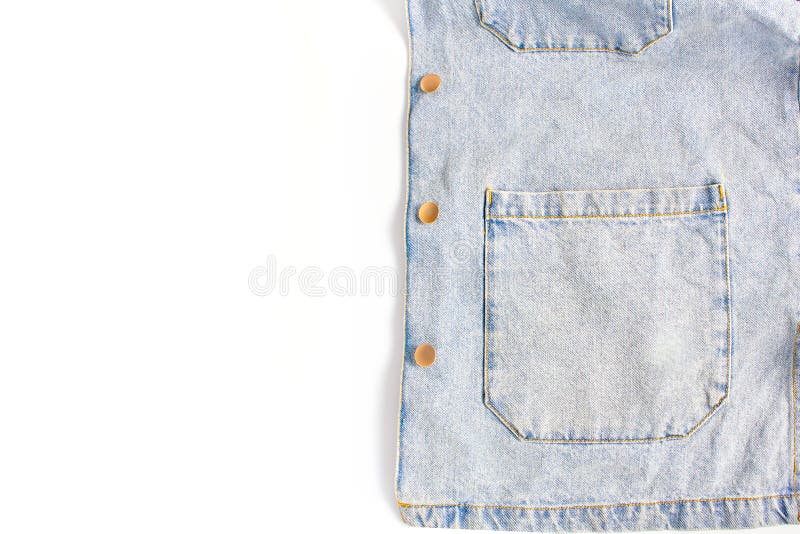
Where is `trim`? This screenshot has width=800, height=534. trim is located at coordinates (606, 507).